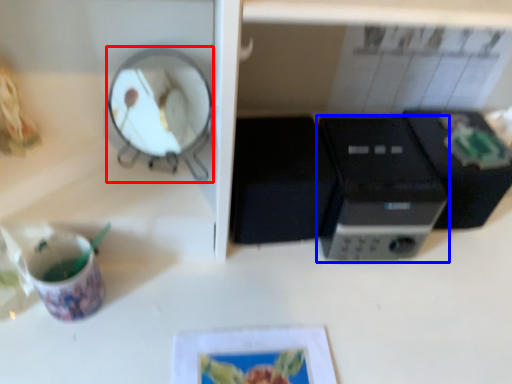
Question: Which point is further to the camera, mirror (highlighted by a red box) or home appliance (highlighted by a blue box)?

Choices:
 (A) mirror
 (B) home appliance

Answer: (B)